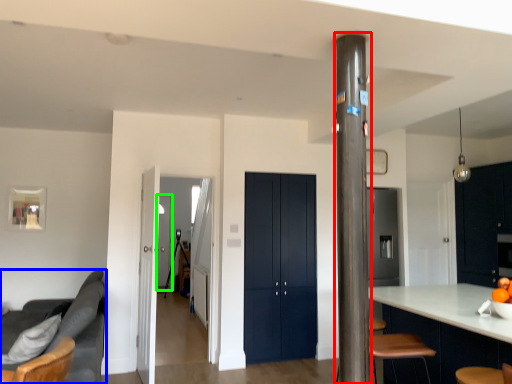
Question: Which object is the farthest from pillar (highlighted by a red box)? Choose among these: studio couch (highlighted by a blue box) or glass door (highlighted by a green box).

Choices:
 (A) studio couch
 (B) glass door

Answer: (B)